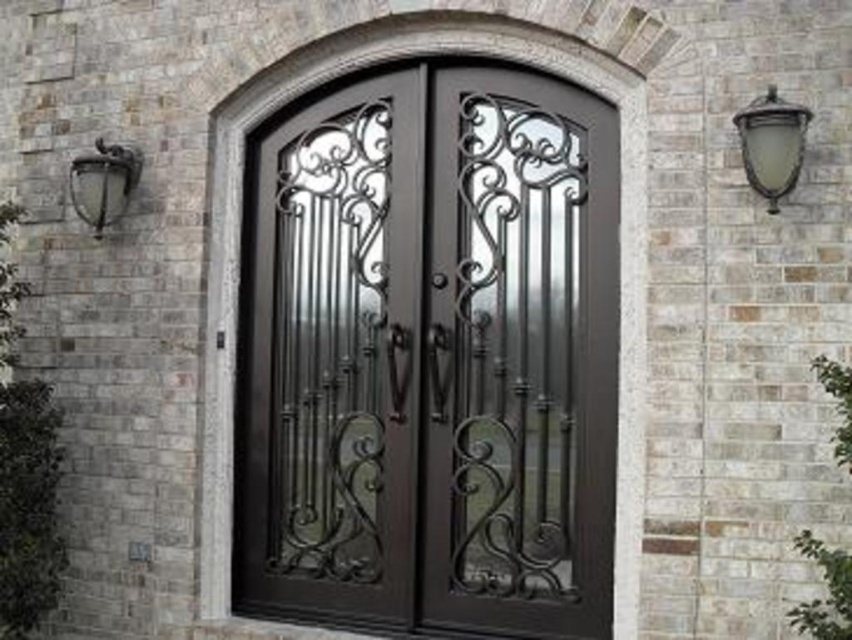
You are an interior designer measuring the distance between the two lamps for a client. The client requires the lamps to be exactly 3 meters apart. Can the matte glass lamp at upper right and the metallic wrought iron lamp at left be placed as per the client request?

The matte glass lamp at upper right is 3.46 meters from the metallic wrought iron lamp at left, so they are 0.46 meters too far apart to meet the client requirement of exactly 3 meters.